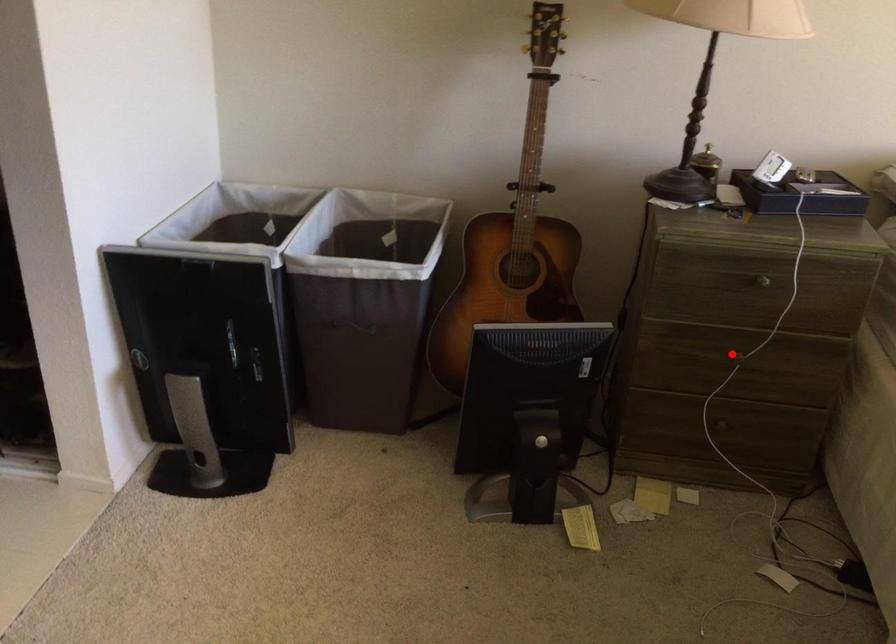
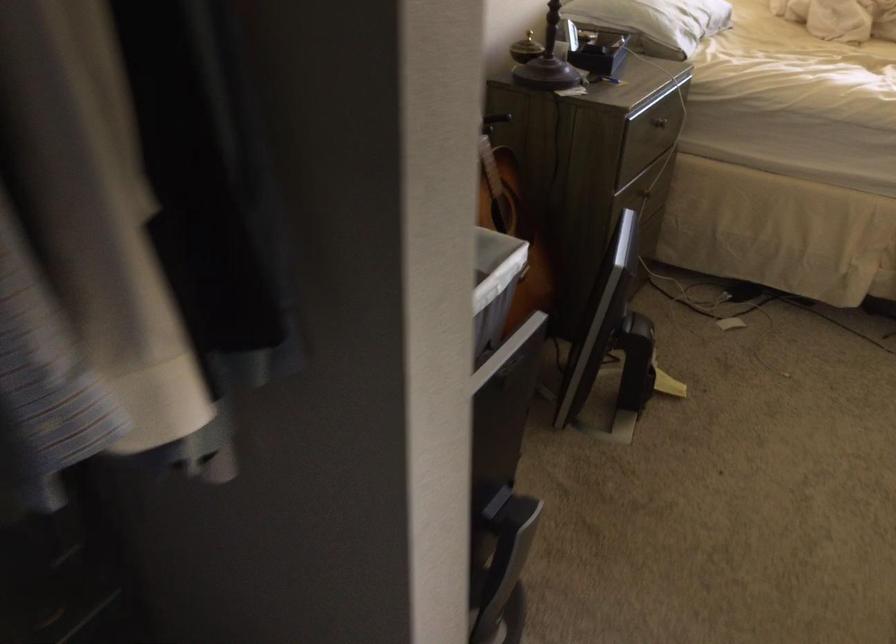
In the second image, find the point that corresponds to the highlighted location in the first image.

(645, 194)